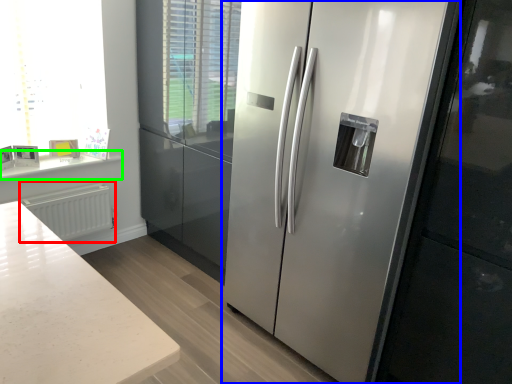
Question: Which object is positioned farthest from radiator (highlighted by a red box)? Select from refrigerator (highlighted by a blue box) and counter top (highlighted by a green box).

Choices:
 (A) refrigerator
 (B) counter top

Answer: (A)